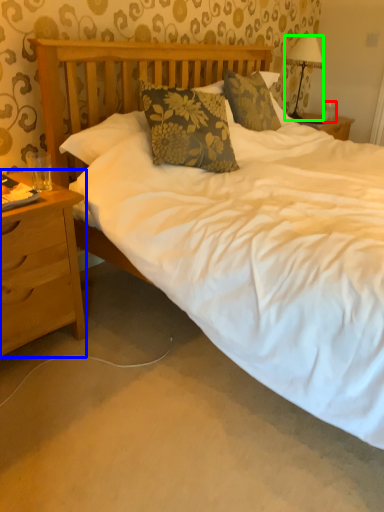
Question: Based on their relative distances, which object is nearer to coffee cup (highlighted by a red box)? Choose from nightstand (highlighted by a blue box) and lamp (highlighted by a green box).

Choices:
 (A) nightstand
 (B) lamp

Answer: (B)